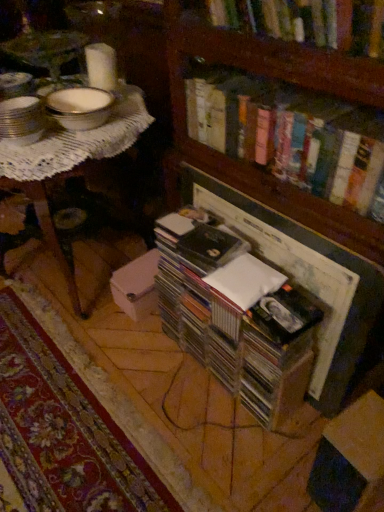
Question: Considering the relative sizes of cardboard box at lower right and white lace table at upper left in the image provided, is cardboard box at lower right smaller than white lace table at upper left?

Choices:
 (A) no
 (B) yes

Answer: (B)

Question: Is cardboard box at lower right shorter than white lace table at upper left?

Choices:
 (A) no
 (B) yes

Answer: (B)

Question: Is the depth of cardboard box at lower right less than that of white lace table at upper left?

Choices:
 (A) yes
 (B) no

Answer: (A)

Question: Can you confirm if cardboard box at lower right is positioned to the right of white lace table at upper left?

Choices:
 (A) no
 (B) yes

Answer: (B)

Question: Is white lace table at upper left located within cardboard box at lower right?

Choices:
 (A) no
 (B) yes

Answer: (A)

Question: Is cardboard box at lower right with white lace table at upper left?

Choices:
 (A) yes
 (B) no

Answer: (B)

Question: Can you confirm if hardcover books at upper center, marked as the 2th book in a bottom-to-top arrangement, is positioned to the right of clear plastic case at center, which is the 1th book in bottom-to-top order?

Choices:
 (A) yes
 (B) no

Answer: (A)

Question: Does hardcover books at upper center, arranged as the 2th book when viewed from the top, have a greater width compared to clear plastic case at center, which appears as the third book when viewed from the top?

Choices:
 (A) yes
 (B) no

Answer: (A)

Question: Can clear plastic case at center, which appears as the third book when viewed from the top, be found inside hardcover books at upper center, marked as the 2th book in a bottom-to-top arrangement?

Choices:
 (A) yes
 (B) no

Answer: (B)

Question: Considering the relative sizes of hardcover books at upper center, arranged as the 2th book when viewed from the top, and clear plastic case at center, which appears as the third book when viewed from the top, in the image provided, is hardcover books at upper center, arranged as the 2th book when viewed from the top, shorter than clear plastic case at center, which appears as the third book when viewed from the top,?

Choices:
 (A) yes
 (B) no

Answer: (A)

Question: Can you confirm if hardcover books at upper center, arranged as the 2th book when viewed from the top, is positioned to the left of clear plastic case at center, which appears as the third book when viewed from the top?

Choices:
 (A) yes
 (B) no

Answer: (B)

Question: Is hardcover books at upper center, marked as the 2th book in a bottom-to-top arrangement, closer to camera compared to clear plastic case at center, which is the 1th book in bottom-to-top order?

Choices:
 (A) no
 (B) yes

Answer: (B)

Question: Considering the relative positions of cardboard box at lower right and hardcover books at upper center, arranged as the 2th book when viewed from the top, in the image provided, is cardboard box at lower right behind hardcover books at upper center, arranged as the 2th book when viewed from the top,?

Choices:
 (A) yes
 (B) no

Answer: (B)